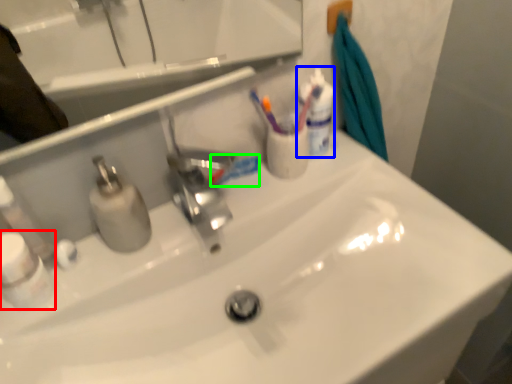
Question: Which object is the closest to the mouthwash (highlighted by a red box)? Choose among these: mouthwash (highlighted by a blue box) or toothpaste (highlighted by a green box).

Choices:
 (A) mouthwash
 (B) toothpaste

Answer: (B)